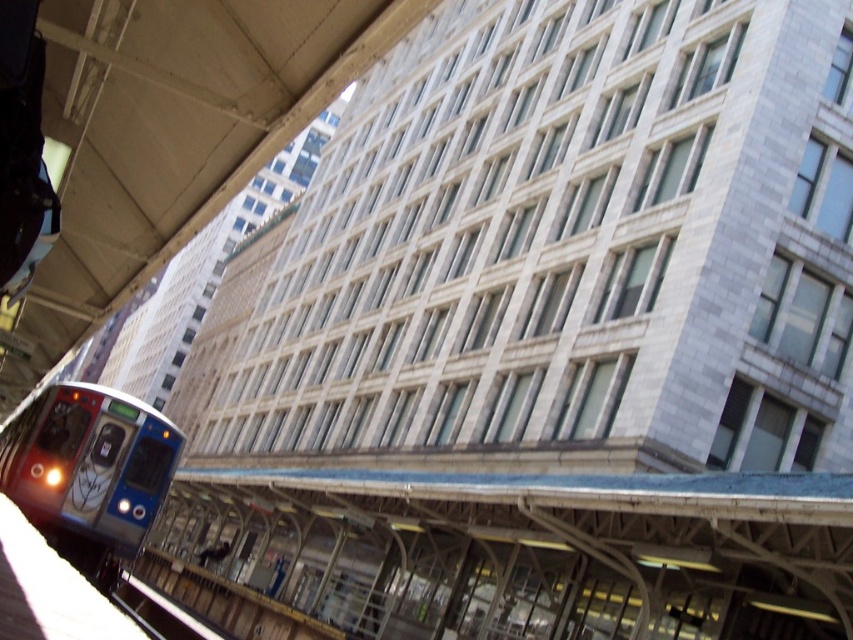
Which is more to the right, metallic blue train at lower left or black metal train track at lower left?

Positioned to the right is black metal train track at lower left.

Is metallic blue train at lower left positioned behind black metal train track at lower left?

No, it is not.

What do you see at coordinates (90, 464) in the screenshot? I see `metallic blue train at lower left` at bounding box center [90, 464].

At what (x,y) coordinates should I click in order to perform the action: click on metallic blue train at lower left. Please return your answer as a coordinate pair (x, y). The image size is (853, 640). Looking at the image, I should click on (90, 464).